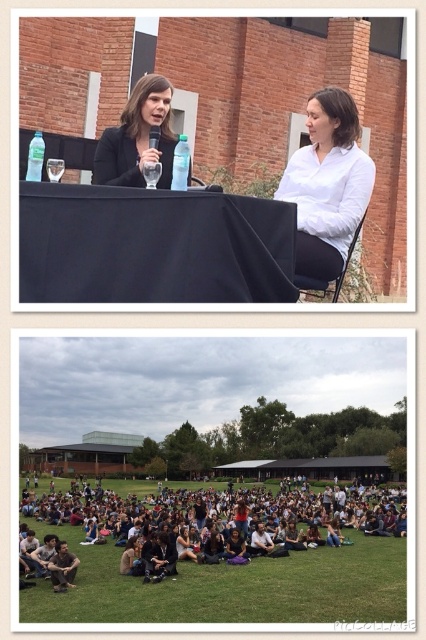
Question: Can you confirm if dark brown hair at lower center is positioned above clear glass wine glass at upper center?

Choices:
 (A) no
 (B) yes

Answer: (A)

Question: Which object is closer to the camera taking this photo?

Choices:
 (A) matte black jacket at upper left
 (B) dark brown hair at lower center
 (C) clear plastic bottle at center
 (D) clear glass wine glass at upper center

Answer: (C)

Question: Can you confirm if matte black jacket at upper left is bigger than clear glass wine glass at upper center?

Choices:
 (A) no
 (B) yes

Answer: (B)

Question: Which object appears closest to the camera in this image?

Choices:
 (A) white matte shirt at center
 (B) clear plastic bottle at center
 (C) matte black jacket at upper left
 (D) clear glass wine glass at upper center

Answer: (B)

Question: Does matte black jacket at upper left appear over clear plastic bottle at center?

Choices:
 (A) yes
 (B) no

Answer: (B)

Question: Which point is farther to the camera?

Choices:
 (A) white matte shirt at center
 (B) clear glass wine glass at upper center
 (C) dark brown hair at lower center

Answer: (C)